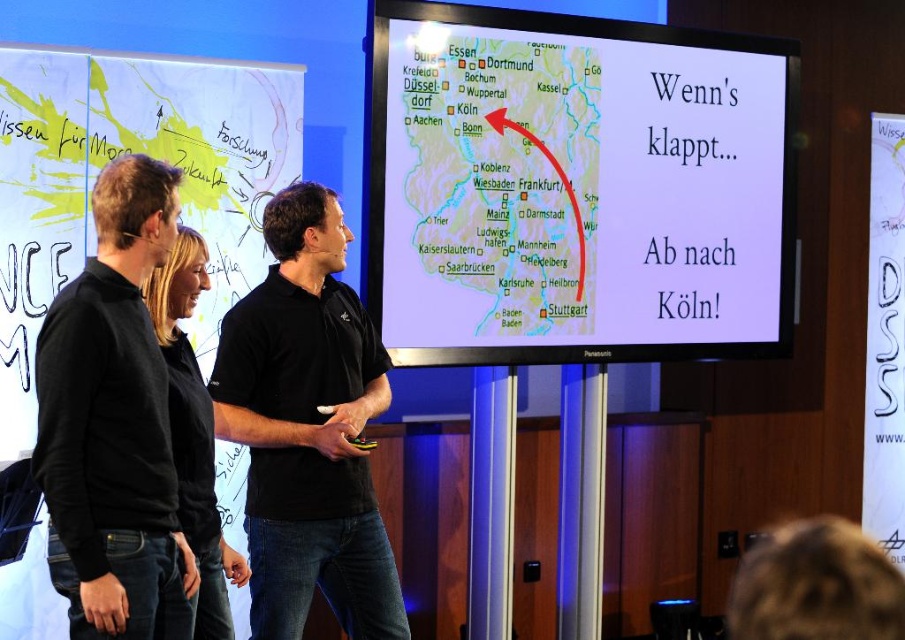
You are an event organizer planning to set up a presentation. You have a white paper map at upper center and a black matte sweater at left. Which object has a greater width?

The white paper map at upper center has a greater width than the black matte sweater at left.

You are attending a presentation and notice two items in the scene. One is the white paper map at upper center and the other is the black matte sweater at left. From your perspective as an attendee, which item is closer to you?

The white paper map at upper center is closer to you because the black matte sweater at left is behind it.